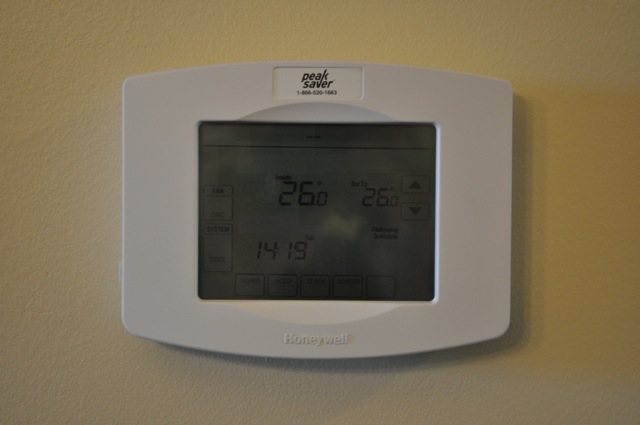
Where is `honeywell thermostat`? This screenshot has width=640, height=425. honeywell thermostat is located at coordinates (323, 341).